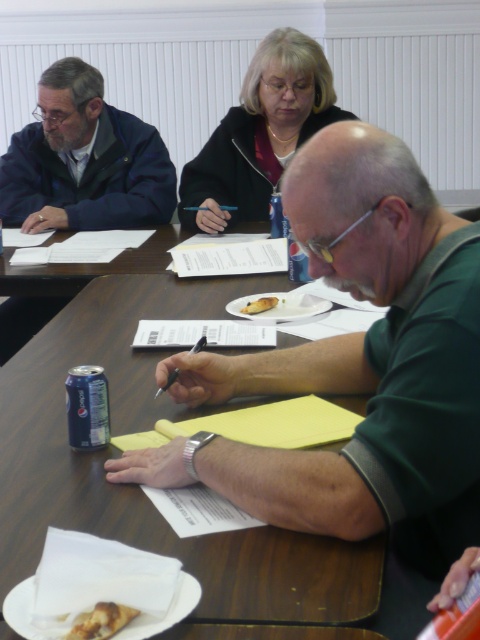
In the scene shown: Is wooden table at center above blue metallic can at table center?

Indeed, wooden table at center is positioned over blue metallic can at table center.

Is the position of wooden table at center less distant than that of blue metallic can at table center?

Yes.

Which is in front, point (1, 416) or point (100, 387)?

Point (100, 387) is more forward.

You are a GUI agent. You are given a task and a screenshot of the screen. Output one action in this format:
    pyautogui.click(x=<x>, y=<y>)
    Task: Click on the wooden table at center
    
    Given the screenshot: What is the action you would take?
    [137, 484]

Is green matte shirt at center above black plastic pen at center?

Yes.

Who is taller, green matte shirt at center or black plastic pen at center?

green matte shirt at center is taller.

Is point (343, 472) positioned behind point (190, 353)?

That is False.

Identify the location of green matte shirt at center. Image resolution: width=480 pixels, height=640 pixels. (359, 374).

Is green matte shirt at center bigger than matte black jacket at upper center?

Yes, green matte shirt at center is bigger than matte black jacket at upper center.

Does green matte shirt at center have a greater width compared to matte black jacket at upper center?

No, green matte shirt at center is not wider than matte black jacket at upper center.

Where is `green matte shirt at center`? The width and height of the screenshot is (480, 640). green matte shirt at center is located at coordinates (359, 374).